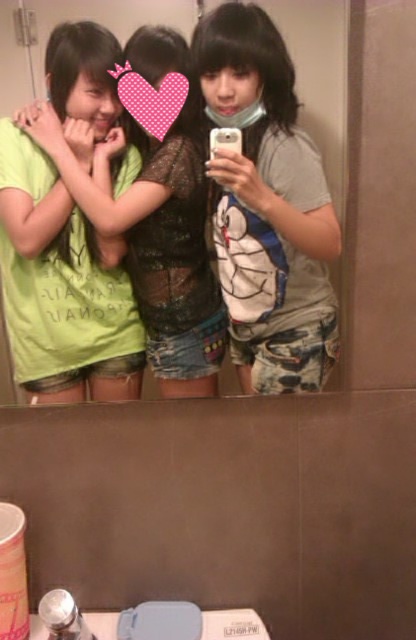
You are standing in a bathroom and see the image. There is a point marked at coordinates (267, 205). What object is located at that point?

The matte gray t shirt at center is located at point (267, 205).

You are standing in the bathroom and want to take a selfie using the mirror. The mirror is at point (289, 273). If your arm can extend 90 centimeters, can you reach the mirror to take the selfie?

The point (289, 273) is 91.50 centimeters away from the viewer. Since your arm can only extend 90 centimeters, you cannot reach the mirror at point (289, 273) to take the selfie.